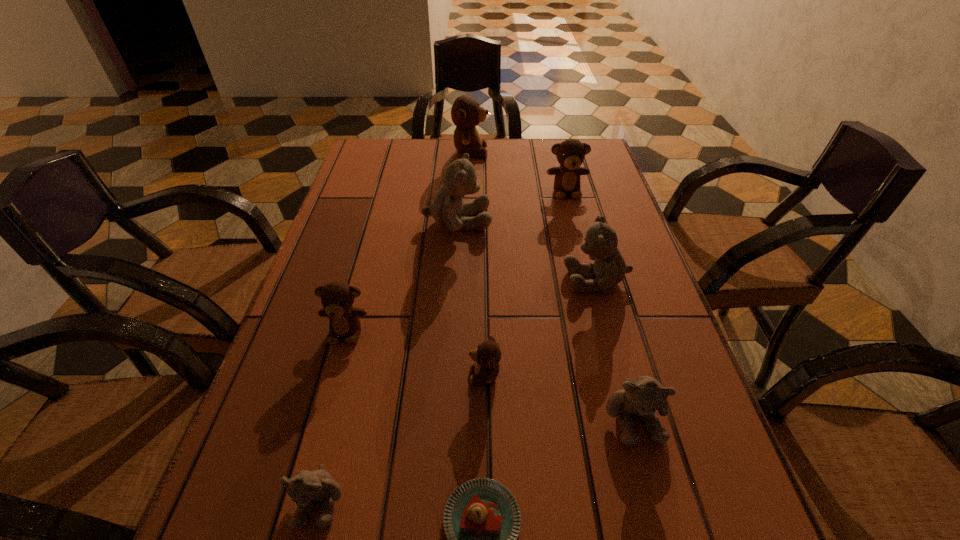
Point out which object is positioned as the seventh nearest to the second nearest gray teddy bear. Please provide its 2D coordinates. Your answer should be formatted as a tuple, i.e. [(x, y)], where the tuple contains the x and y coordinates of a point satisfying the conditions above.

[(570, 154)]

Locate an element on the screen. This screenshot has width=960, height=540. object that is the seventh nearest to the nearest teddy bear is located at coordinates click(x=570, y=154).

Image resolution: width=960 pixels, height=540 pixels. I want to click on teddy bear that is the seventh closest to the nearest brown teddy bear, so click(466, 113).

Point out which teddy bear is positioned as the fourth nearest to the fifth nearest object. Please provide its 2D coordinates. Your answer should be formatted as a tuple, i.e. [(x, y)], where the tuple contains the x and y coordinates of a point satisfying the conditions above.

[(609, 268)]

Where is `the third closest brown teddy bear relative to the nearest brown teddy bear`? The height and width of the screenshot is (540, 960). the third closest brown teddy bear relative to the nearest brown teddy bear is located at coordinates [466, 113].

Identify which brown teddy bear is located as the nearest to the farthest brown teddy bear. Please provide its 2D coordinates. Your answer should be formatted as a tuple, i.e. [(x, y)], where the tuple contains the x and y coordinates of a point satisfying the conditions above.

[(570, 154)]

Locate which gray teddy bear is the second closest to the third farthest gray teddy bear. Please provide its 2D coordinates. Your answer should be formatted as a tuple, i.e. [(x, y)], where the tuple contains the x and y coordinates of a point satisfying the conditions above.

[(305, 488)]

Identify the location of gray teddy bear that stands as the third closest to the farthest teddy bear. The image size is (960, 540). (641, 397).

Where is `vacant area that satisfies the following two spatial constraints: 1. on the face of the third nearest brown teddy bear; 2. on the face of the third farthest teddy bear`? Image resolution: width=960 pixels, height=540 pixels. vacant area that satisfies the following two spatial constraints: 1. on the face of the third nearest brown teddy bear; 2. on the face of the third farthest teddy bear is located at coordinates (574, 221).

Where is `free location that satisfies the following two spatial constraints: 1. on the face of the farthest object; 2. on the face of the third biggest brown teddy bear`? free location that satisfies the following two spatial constraints: 1. on the face of the farthest object; 2. on the face of the third biggest brown teddy bear is located at coordinates (465, 330).